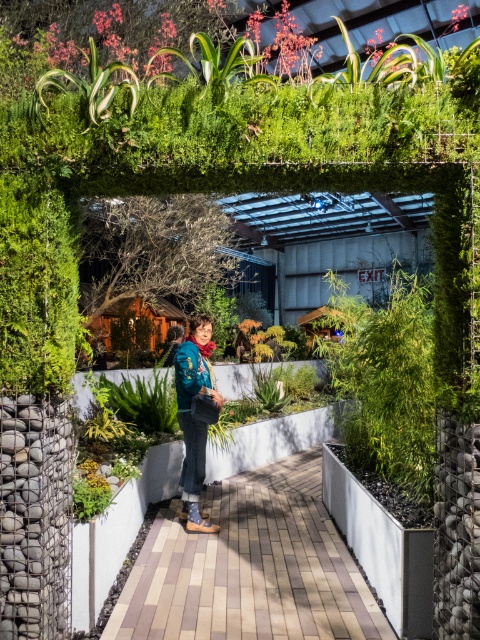
Question: Considering the real-world distances, which object is farthest from the brick paved walkway at center?

Choices:
 (A) denim jacket at center
 (B) textured blue jacket at center

Answer: (B)

Question: Estimate the real-world distances between objects in this image. Which object is farther from the textured blue jacket at center?

Choices:
 (A) denim jacket at center
 (B) brick paved walkway at center

Answer: (B)

Question: Where is denim jacket at center located in relation to textured blue jacket at center in the image?

Choices:
 (A) above
 (B) below

Answer: (B)

Question: Is brick paved walkway at center smaller than textured blue jacket at center?

Choices:
 (A) no
 (B) yes

Answer: (A)

Question: Does denim jacket at center lie behind textured blue jacket at center?

Choices:
 (A) no
 (B) yes

Answer: (B)

Question: Which point is farther to the camera?

Choices:
 (A) (186, 404)
 (B) (194, 378)
 (C) (186, 600)

Answer: (A)